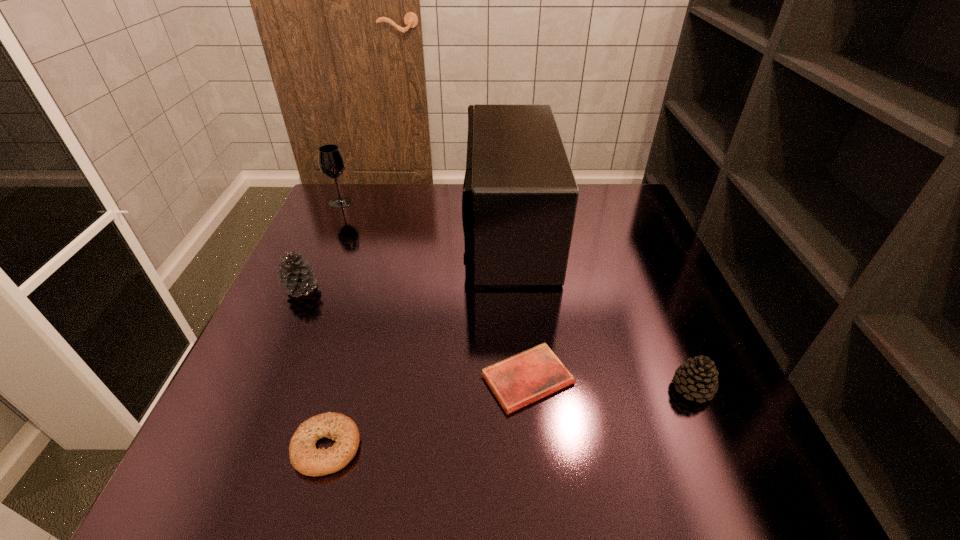
This screenshot has height=540, width=960. Identify the location of free region at the far left corner of the desktop. (377, 195).

In the image, there is a desktop. Identify the location of blank space at the far right corner. This screenshot has height=540, width=960. (625, 188).

Where is `free space between the taller pinecone and the microwave_oven`? The image size is (960, 540). free space between the taller pinecone and the microwave_oven is located at coordinates (405, 259).

You are a GUI agent. You are given a task and a screenshot of the screen. Output one action in this format:
    pyautogui.click(x=<x>, y=<y>)
    Task: Click on the vacant space that is in between the bagel and the diary
    
    Given the screenshot: What is the action you would take?
    [427, 413]

Where is `free area in between the tallest object and the shorter pinecone`? free area in between the tallest object and the shorter pinecone is located at coordinates (600, 309).

Identify the location of vacant region between the microwave_oven and the diary. (517, 305).

You are a GUI agent. You are given a task and a screenshot of the screen. Output one action in this format:
    pyautogui.click(x=<x>, y=<y>)
    Task: Click on the vacant space in between the wineglass and the diary
    The width and height of the screenshot is (960, 540).
    Given the screenshot: What is the action you would take?
    pyautogui.click(x=434, y=291)

Locate an element on the screen. free spot between the shortest object and the second shortest object is located at coordinates coord(427,413).

Image resolution: width=960 pixels, height=540 pixels. Identify the location of empty location between the taller pinecone and the diary. (415, 334).

In order to click on empty location between the bagel and the wineglass in this screenshot , I will do `click(334, 325)`.